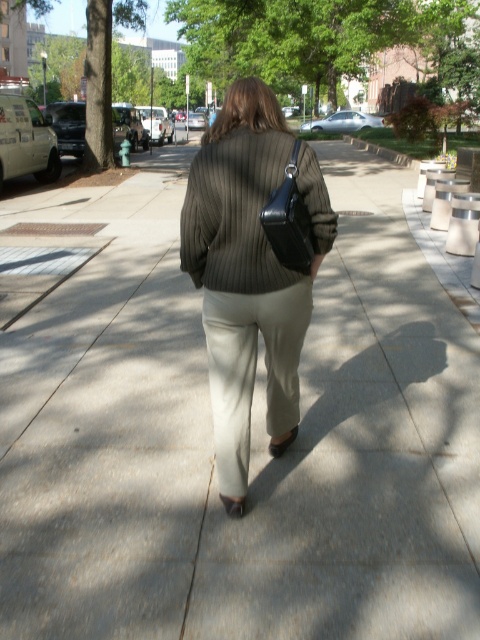
You are a fashion designer observing the person in the image. You need to determine the placement of the ribbed wool sweater at center and the black leather bag at center. Which item is positioned higher on the person?

The ribbed wool sweater at center is located above the black leather bag at center, so the sweater is positioned higher on the person.

In the scene shown: You are a photographer trying to capture the ribbed sweater at center in the image. The camera is set to focus on the point at coordinates point (250,273). Will this point be sufficient to ensure the ribbed sweater at center is in focus?

Yes, the point at coordinates point (250,273) directly corresponds to the ribbed sweater at center, so focusing there will ensure it is in focus.

You are a fashion designer observing the person in the image. You need to determine which item of clothing or accessory is bigger in size between the ribbed sweater at center and the black leather bag at center. Which one is larger?

The ribbed sweater at center has a larger size compared to the black leather bag at center, so the ribbed sweater at center is bigger.